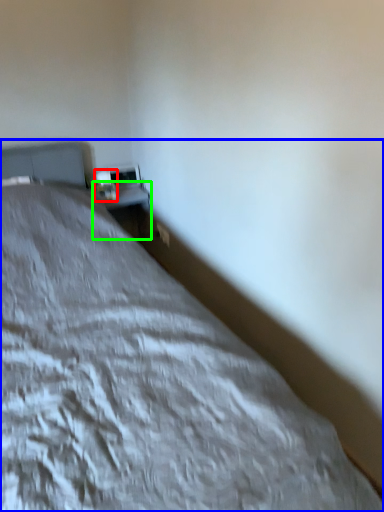
Question: Considering the real-world distances, which object is farthest from table lamp (highlighted by a red box)? bed (highlighted by a blue box) or table (highlighted by a green box)?

Choices:
 (A) bed
 (B) table

Answer: (A)